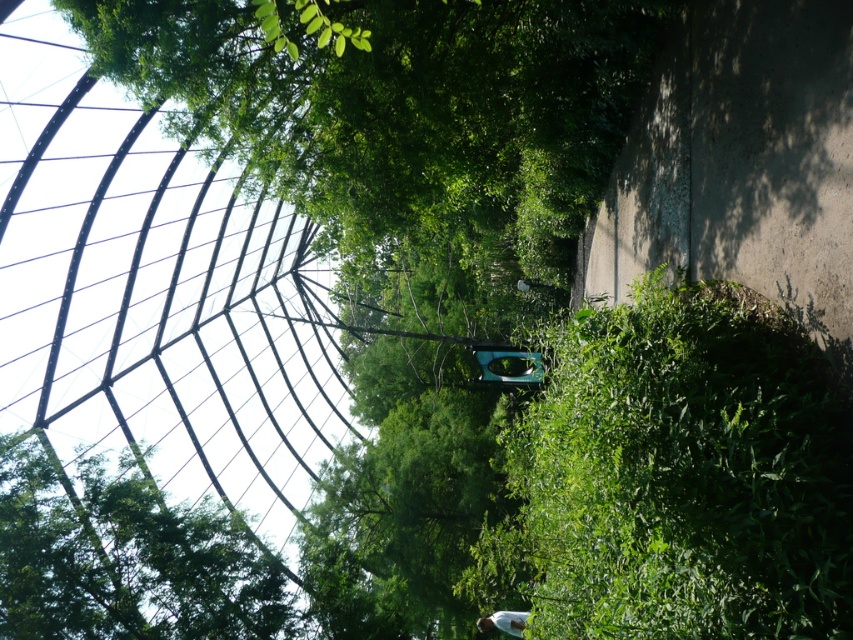
Question: Which point is farther to the camera?

Choices:
 (A) (535, 65)
 (B) (61, 512)
 (C) (521, 621)

Answer: (C)

Question: Can you confirm if green leafy tree at upper left is positioned below white matte shirt at lower center?

Choices:
 (A) yes
 (B) no

Answer: (B)

Question: Which object is closer to the camera taking this photo?

Choices:
 (A) green leafy tree at upper left
 (B) white matte shirt at lower center
 (C) green leafy tree at upper center

Answer: (C)

Question: Can you confirm if green leafy tree at upper center is positioned to the right of green leafy tree at upper left?

Choices:
 (A) no
 (B) yes

Answer: (B)

Question: Does green leafy tree at upper left appear over white matte shirt at lower center?

Choices:
 (A) no
 (B) yes

Answer: (B)

Question: Considering the real-world distances, which object is farthest from the green leafy tree at upper left?

Choices:
 (A) white matte shirt at lower center
 (B) green leafy tree at upper center

Answer: (B)